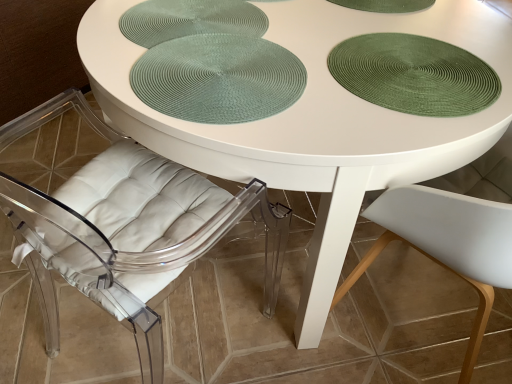
Locate an element on the screen. vacant area that lies between green woven placemat at upper center, which ranks as the 2th glass plate in right-to-left order, and green woven placemat at center is located at coordinates (243, 43).